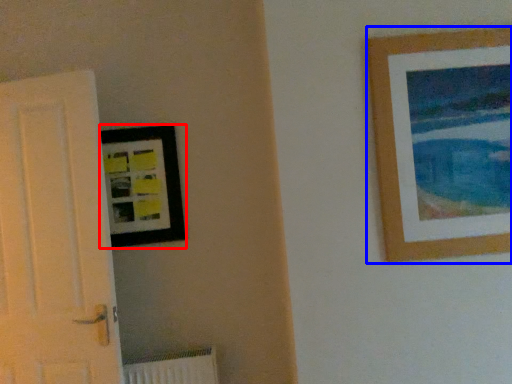
Question: Which of the following is the farthest to the observer, picture frame (highlighted by a red box) or picture frame (highlighted by a blue box)?

Choices:
 (A) picture frame
 (B) picture frame

Answer: (A)